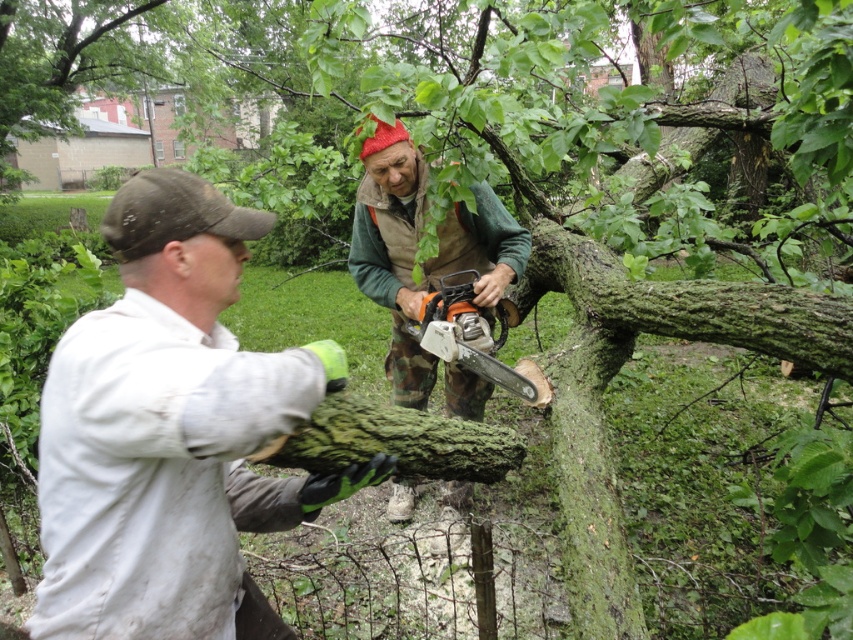
Question: Is white matte shirt at left wider than camouflage pants at center?

Choices:
 (A) yes
 (B) no

Answer: (B)

Question: Which object appears closest to the camera in this image?

Choices:
 (A) orange plastic chainsaw at center
 (B) camouflage pants at center

Answer: (A)

Question: Which point is closer to the camera?

Choices:
 (A) (523, 381)
 (B) (461, 237)
 (C) (48, 628)

Answer: (C)

Question: Considering the relative positions of white matte shirt at left and orange plastic chainsaw at center in the image provided, where is white matte shirt at left located with respect to orange plastic chainsaw at center?

Choices:
 (A) right
 (B) left

Answer: (B)

Question: Is white matte shirt at left below camouflage pants at center?

Choices:
 (A) yes
 (B) no

Answer: (A)

Question: Which point appears farthest from the camera in this image?

Choices:
 (A) (76, 321)
 (B) (500, 304)

Answer: (B)